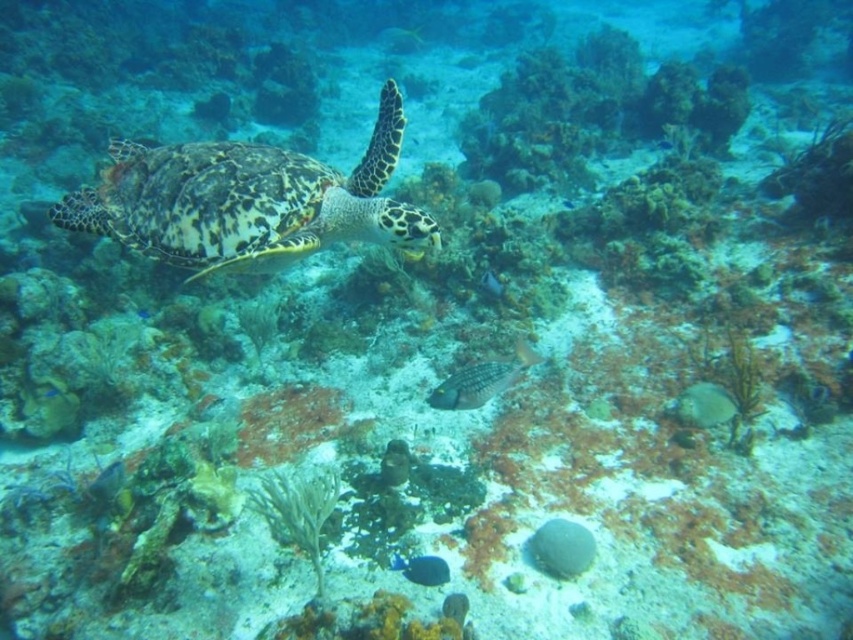
Question: Where is shiny yellow fish at center located in relation to shiny blue fish at center in the image?

Choices:
 (A) right
 (B) left

Answer: (A)

Question: Does leathery brown turtle at center appear under shiny silver fish at center?

Choices:
 (A) yes
 (B) no

Answer: (B)

Question: Which object appears farthest from the camera in this image?

Choices:
 (A) leathery brown turtle at center
 (B) shiny blue fish at center
 (C) speckled brown fish at center

Answer: (B)

Question: Can you confirm if leathery brown turtle at center is positioned above shiny blue fish at center?

Choices:
 (A) no
 (B) yes

Answer: (B)

Question: Among these objects, which one is farthest from the camera?

Choices:
 (A) speckled brown fish at center
 (B) shiny yellow fish at center
 (C) shiny silver fish at center

Answer: (B)

Question: Which object is closer to the camera taking this photo?

Choices:
 (A) shiny yellow fish at center
 (B) leathery brown turtle at center
 (C) shiny blue fish at center
 (D) speckled brown fish at center

Answer: (B)